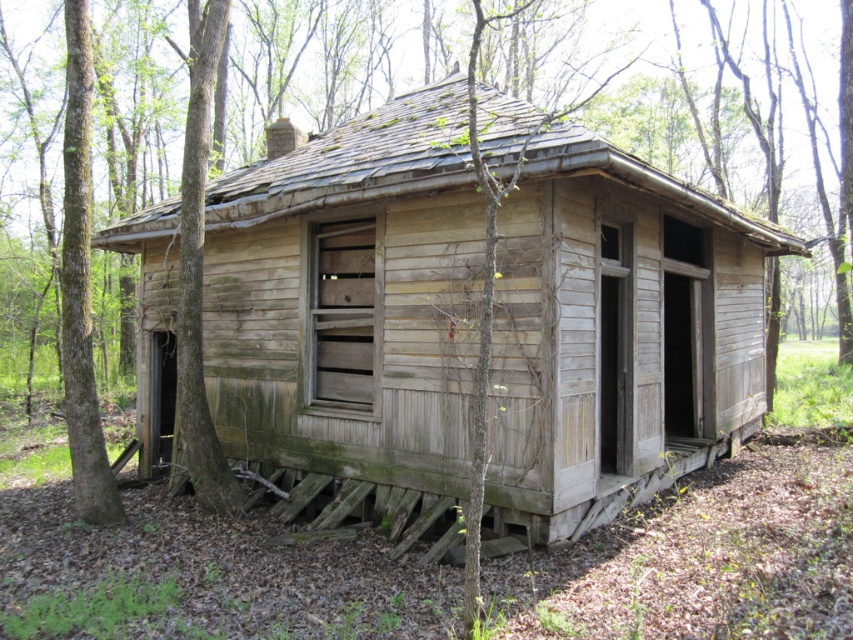
Which is behind, point (389, 408) or point (94, 461)?

Point (94, 461)

Which is in front, point (695, 244) or point (84, 189)?

Positioned in front is point (84, 189).

The image size is (853, 640). What do you see at coordinates (350, 307) in the screenshot? I see `weathered wood cabin at center` at bounding box center [350, 307].

Where is `weathered wood cabin at center`? The image size is (853, 640). weathered wood cabin at center is located at coordinates (x=350, y=307).